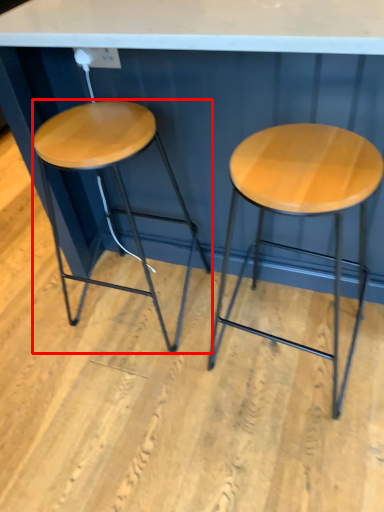
Question: From the image's perspective, considering the relative positions of stool (annotated by the red box) and stool in the image provided, where is stool (annotated by the red box) located with respect to the staircase?

Choices:
 (A) below
 (B) above

Answer: (B)